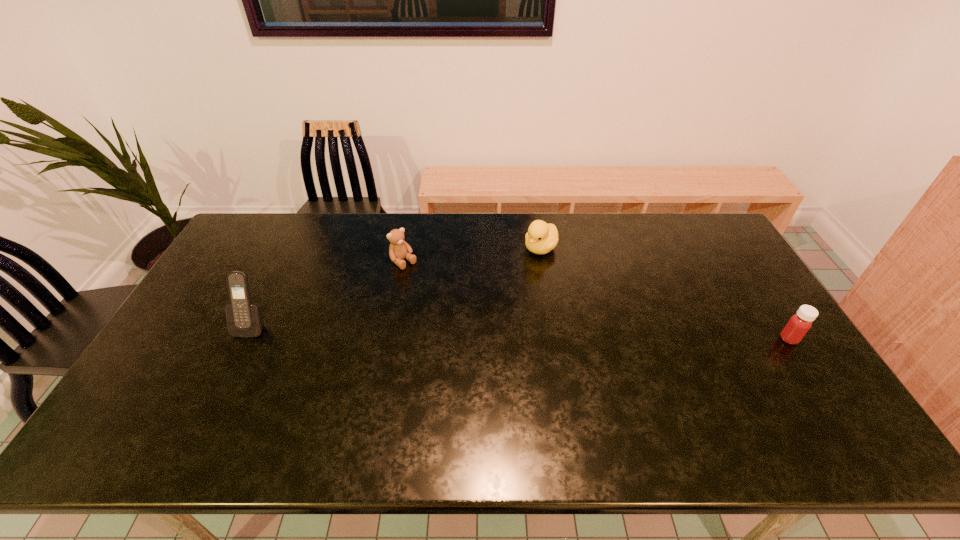
Image resolution: width=960 pixels, height=540 pixels. I want to click on free space between the second object from left to right and the third object from left to right, so click(472, 255).

Where is `empty space that is in between the duck and the medicine`? This screenshot has width=960, height=540. empty space that is in between the duck and the medicine is located at coordinates (665, 293).

Locate an element on the screen. unoccupied area between the medicine and the leftmost object is located at coordinates (520, 332).

Identify the location of blank region between the medicine and the tallest object. (520, 332).

Where is `blank region between the teddy bear and the second object from right to left`? This screenshot has width=960, height=540. blank region between the teddy bear and the second object from right to left is located at coordinates (472, 255).

You are a GUI agent. You are given a task and a screenshot of the screen. Output one action in this format:
    pyautogui.click(x=<x>, y=<y>)
    Task: Click on the vacant area that lies between the medicine and the second object from right to left
    
    Given the screenshot: What is the action you would take?
    pyautogui.click(x=665, y=293)

At what (x,y) coordinates should I click in order to perform the action: click on free area in between the rightmost object and the second object from right to left. Please return your answer as a coordinate pair (x, y). This screenshot has width=960, height=540. Looking at the image, I should click on (665, 293).

Where is `unoccupied area between the medicine and the third object from left to right`? The width and height of the screenshot is (960, 540). unoccupied area between the medicine and the third object from left to right is located at coordinates (665, 293).

Find the location of a particular element. empty space between the duck and the teddy bear is located at coordinates (472, 255).

Identify the location of empty space between the duck and the rightmost object. (665, 293).